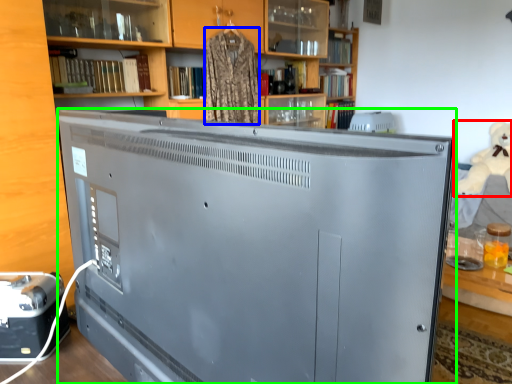
Question: Based on their relative distances, which object is farther from toy (highlighted by a red box)? Choose from clothing (highlighted by a blue box) and television (highlighted by a green box).

Choices:
 (A) clothing
 (B) television

Answer: (B)